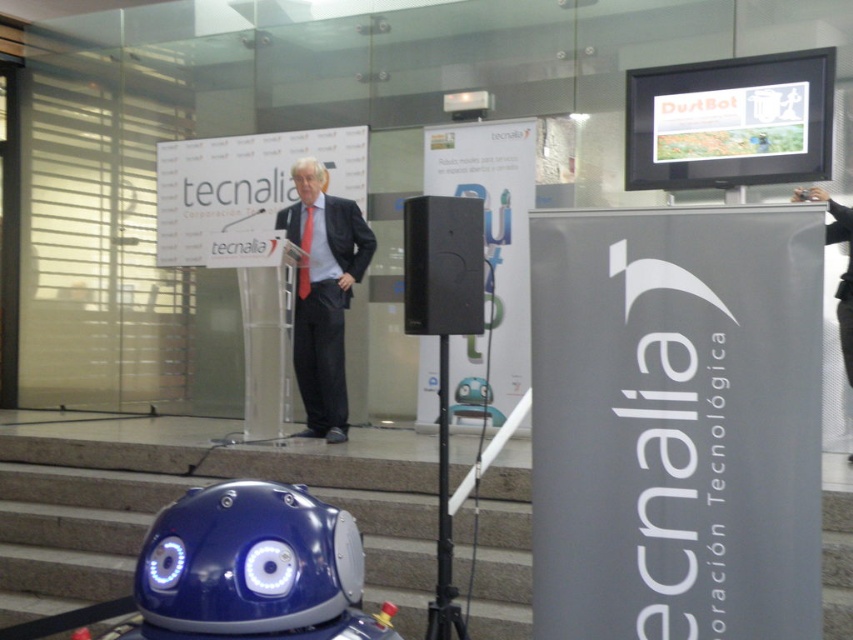
Question: From the image, what is the correct spatial relationship of matte black suit at center in relation to dark gray suit at center?

Choices:
 (A) right
 (B) left

Answer: (B)

Question: Based on their relative distances, which object is farther from the smooth concrete stairs at lower center?

Choices:
 (A) black matte speaker at center
 (B) matte black suit at center

Answer: (A)

Question: Is matte black suit at center to the right of black matte speaker at center from the viewer's perspective?

Choices:
 (A) yes
 (B) no

Answer: (B)

Question: Which object is the farthest from the smooth concrete stairs at lower center?

Choices:
 (A) black matte speaker at center
 (B) matte black suit at center

Answer: (A)

Question: Among these objects, which one is nearest to the camera?

Choices:
 (A) smooth concrete stairs at lower center
 (B) matte black suit at center
 (C) dark gray suit at center

Answer: (A)

Question: Can you confirm if smooth concrete stairs at lower center is bigger than black matte speaker at center?

Choices:
 (A) no
 (B) yes

Answer: (B)